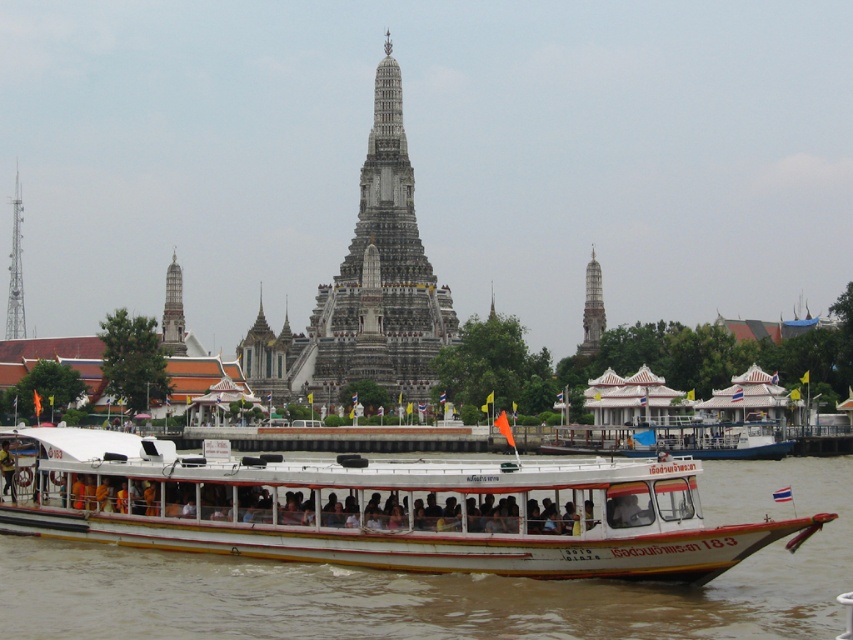
Question: Which point is farther to the camera?

Choices:
 (A) gray stone tower at center
 (B) white stone tower at right
 (C) white matte boat at center

Answer: (B)

Question: Which point is farther from the camera taking this photo?

Choices:
 (A) (161, 342)
 (B) (387, 380)

Answer: (A)

Question: Can you confirm if metallic tower at left is thinner than white stone tower at left?

Choices:
 (A) no
 (B) yes

Answer: (A)

Question: Can you confirm if white matte boat at center is positioned to the left of white stone tower at right?

Choices:
 (A) yes
 (B) no

Answer: (A)

Question: Which of the following is the closest to the observer?

Choices:
 (A) white stone tower at right
 (B) white matte boat at center
 (C) metallic tower at left
 (D) white stone tower at left

Answer: (B)

Question: Does white matte boat at center come behind white stone tower at right?

Choices:
 (A) yes
 (B) no

Answer: (B)